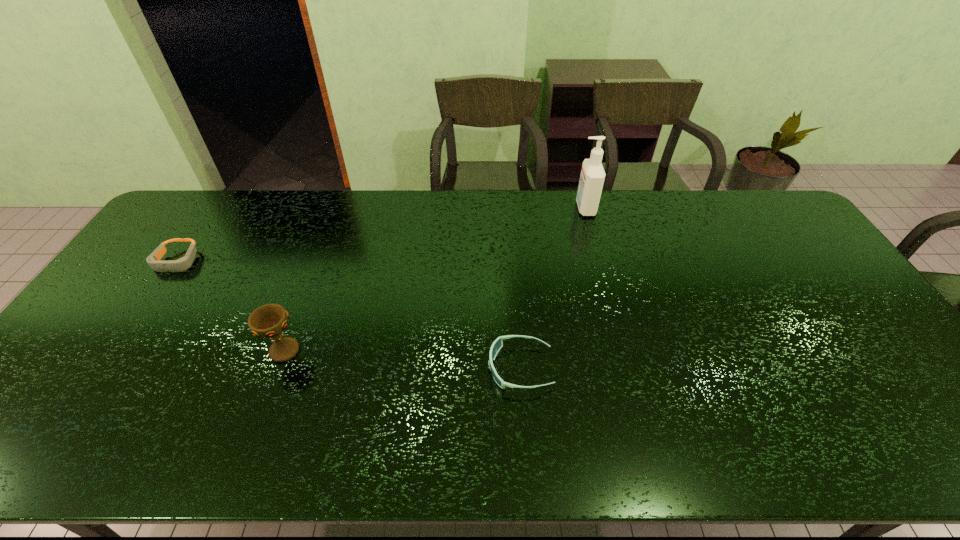
This screenshot has width=960, height=540. Identify the location of free space located 0.250m on the front label of the rightmost object. (505, 208).

Where is `free space located on the left of the second tallest object`? The height and width of the screenshot is (540, 960). free space located on the left of the second tallest object is located at coordinates point(167,350).

Find the location of a particular element. The width and height of the screenshot is (960, 540). vacant region located 0.350m on the front-facing side of the nearer goggles is located at coordinates (349, 368).

Identify the location of free space located 0.310m on the front-facing side of the nearer goggles. Image resolution: width=960 pixels, height=540 pixels. [x=365, y=368].

Where is `vacant space positioned on the front-facing side of the nearer goggles`? This screenshot has width=960, height=540. vacant space positioned on the front-facing side of the nearer goggles is located at coordinates (346, 368).

Locate an element on the screen. free space located 0.180m on the front and back of the shortest object is located at coordinates (133, 325).

The image size is (960, 540). Find the location of `object present at the far edge`. object present at the far edge is located at coordinates (592, 177).

The width and height of the screenshot is (960, 540). I want to click on object situated at the left edge, so [x=154, y=260].

At what (x,y) coordinates should I click in order to perform the action: click on vacant space at the far edge of the desktop. Please return your answer as a coordinate pair (x, y). This screenshot has width=960, height=540. Looking at the image, I should click on (494, 215).

Locate an element on the screen. free spot at the right edge of the desktop is located at coordinates (803, 307).